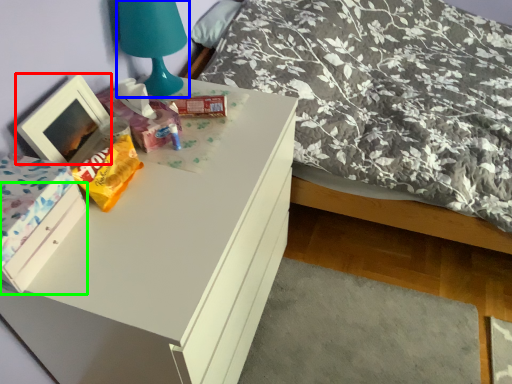
Question: Which object is the closest to the picture frame (highlighted by a red box)? Choose among these: table lamp (highlighted by a blue box) or drawer (highlighted by a green box).

Choices:
 (A) table lamp
 (B) drawer

Answer: (B)